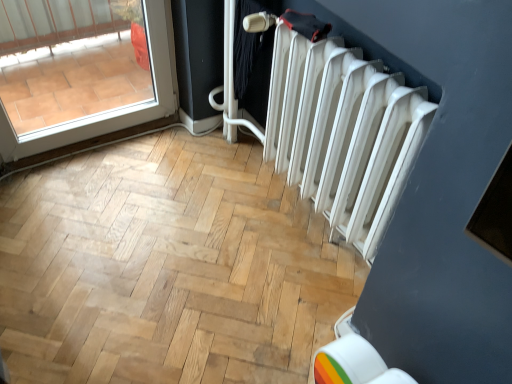
Question: In the image, is transparent glass door at upper left positioned in front of or behind white matte radiator at right?

Choices:
 (A) behind
 (B) front

Answer: (A)

Question: Choose the correct answer: Is transparent glass door at upper left inside white matte radiator at right or outside it?

Choices:
 (A) outside
 (B) inside

Answer: (A)

Question: From the image's perspective, relative to white matte radiator at right, is transparent glass door at upper left above or below?

Choices:
 (A) above
 (B) below

Answer: (A)

Question: Is white matte radiator at right spatially inside transparent glass door at upper left, or outside of it?

Choices:
 (A) outside
 (B) inside

Answer: (A)

Question: Does point (291, 163) appear closer or farther from the camera than point (13, 134)?

Choices:
 (A) closer
 (B) farther

Answer: (A)

Question: In terms of height, does white matte radiator at right look taller or shorter compared to transparent glass door at upper left?

Choices:
 (A) short
 (B) tall

Answer: (B)

Question: Relative to transparent glass door at upper left, is white matte radiator at right in front or behind?

Choices:
 (A) front
 (B) behind

Answer: (A)